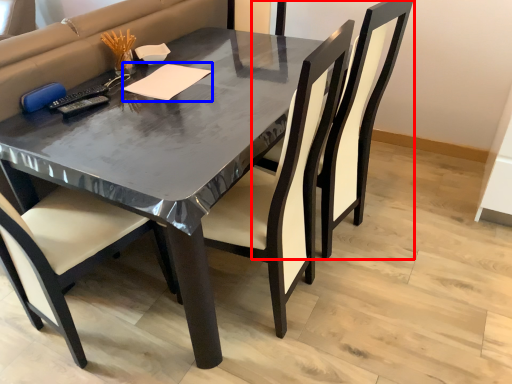
Question: Which object appears farthest to the camera in this image, chair (highlighted by a red box) or notepad (highlighted by a blue box)?

Choices:
 (A) chair
 (B) notepad

Answer: (B)